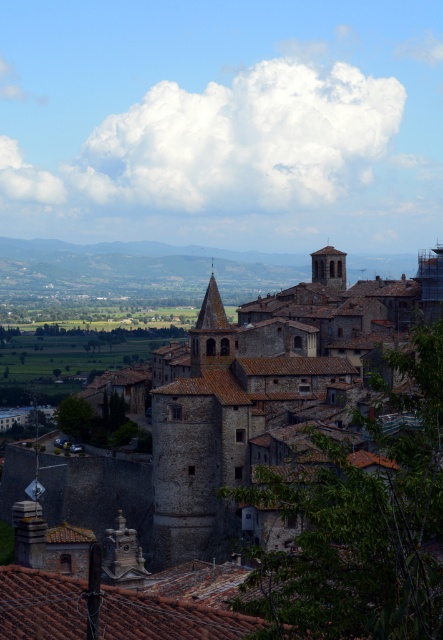
In the scene shown: Is brown stone tower at center to the left of smooth stone tower at upper right from the viewer's perspective?

Indeed, brown stone tower at center is positioned on the left side of smooth stone tower at upper right.

Is point (49, 528) closer to viewer compared to point (322, 268)?

Yes, it is in front of point (322, 268).

Locate an element on the screen. brown stone tower at center is located at coordinates (275, 483).

The width and height of the screenshot is (443, 640). In order to click on brown stone tower at center in this screenshot , I will do `click(275, 483)`.